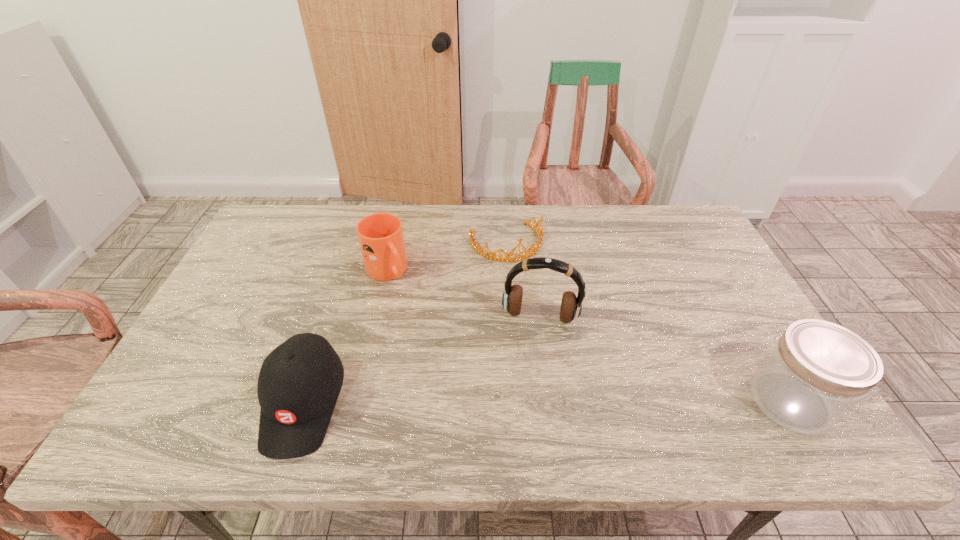
Where is `vacant area situated 0.320m on the handle side of the mug`? The image size is (960, 540). vacant area situated 0.320m on the handle side of the mug is located at coordinates (456, 359).

Where is `vacant space located on the handle side of the mug`? The height and width of the screenshot is (540, 960). vacant space located on the handle side of the mug is located at coordinates (412, 305).

This screenshot has height=540, width=960. In order to click on vacant region located on the ear cup of the third nearest object in this screenshot , I will do `click(527, 387)`.

The width and height of the screenshot is (960, 540). I want to click on free space located on the ear cup of the third nearest object, so click(x=531, y=360).

The height and width of the screenshot is (540, 960). Find the location of `vacant space positioned on the ear cup of the third nearest object`. vacant space positioned on the ear cup of the third nearest object is located at coordinates (529, 373).

Locate an element on the screen. This screenshot has height=540, width=960. object located at the far edge is located at coordinates (540, 234).

This screenshot has height=540, width=960. I want to click on baseball cap that is at the near edge, so click(299, 382).

Where is `jar that is at the near edge`? jar that is at the near edge is located at coordinates (817, 371).

Identify the location of object that is at the right edge. This screenshot has height=540, width=960. (817, 371).

This screenshot has width=960, height=540. Identify the location of object that is at the near right corner. (817, 371).